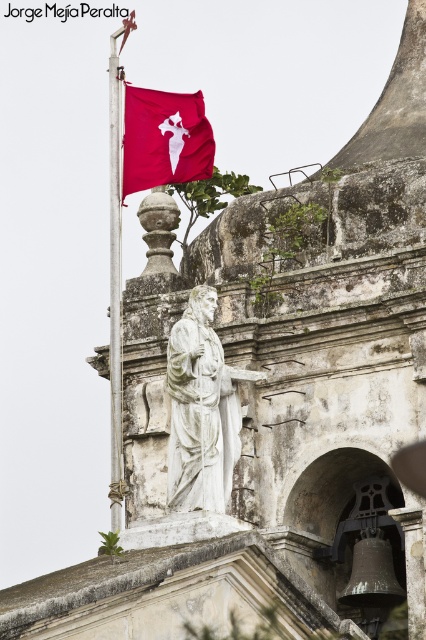
Is white marble statue at center behind matte red flag at upper left?

No, white marble statue at center is in front of matte red flag at upper left.

Can you confirm if white marble statue at center is bigger than matte red flag at upper left?

Yes.

This screenshot has width=426, height=640. Describe the element at coordinates (201, 410) in the screenshot. I see `white marble statue at center` at that location.

Locate an element on the screen. The width and height of the screenshot is (426, 640). white marble statue at center is located at coordinates (201, 410).

Between white marble statue at center and metallic flag pole at upper left, which one has less height?

white marble statue at center

Does white marble statue at center have a larger size compared to metallic flag pole at upper left?

Actually, white marble statue at center might be smaller than metallic flag pole at upper left.

Which is behind, point (256, 372) or point (112, 225)?

The point (112, 225) is more distant.

At what (x,y) coordinates should I click in order to perform the action: click on white marble statue at center. Please return your answer as a coordinate pair (x, y). The width and height of the screenshot is (426, 640). Looking at the image, I should click on (201, 410).

Which of these two, matte red flag at upper left or metallic flag pole at upper left, stands taller?

metallic flag pole at upper left is taller.

Describe the element at coordinates (164, 138) in the screenshot. I see `matte red flag at upper left` at that location.

Who is more forward, (x=206, y=125) or (x=115, y=211)?

Point (x=206, y=125) is in front.

Image resolution: width=426 pixels, height=640 pixels. What are the coordinates of `matte red flag at upper left` in the screenshot? It's located at (164, 138).